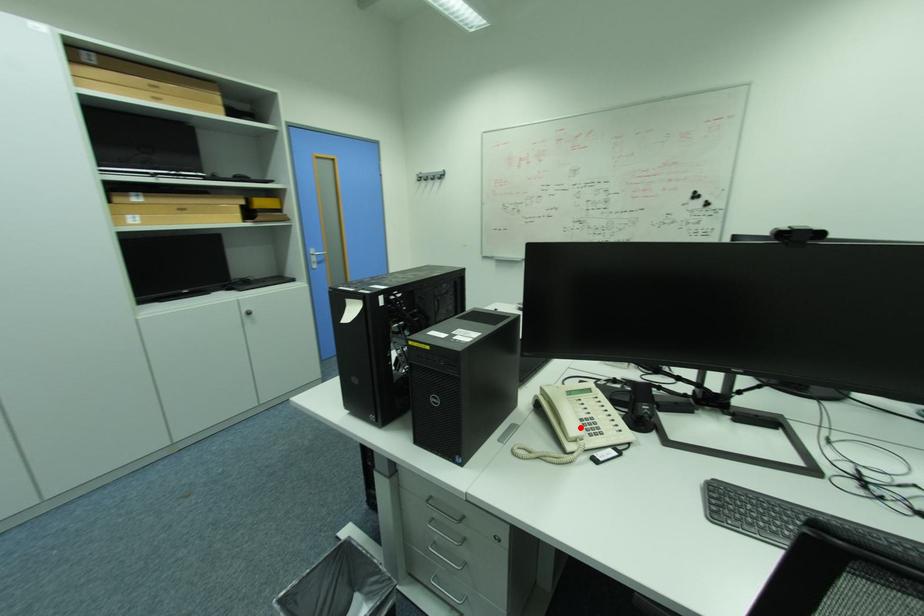
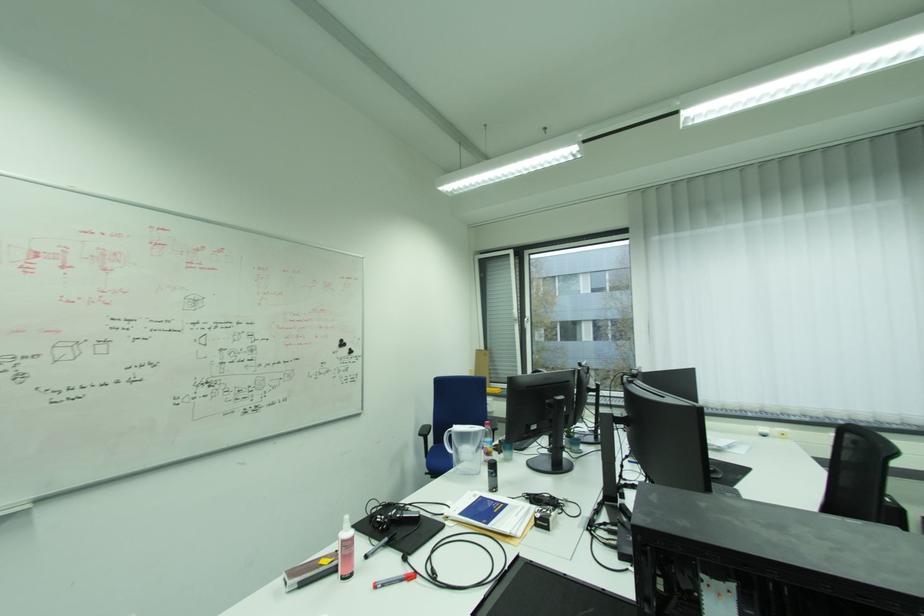
Question: I am providing you with two images of the same scene from different viewpoints. A red point is marked on the first image. Is the red point's position out of view in image 2?

Choices:
 (A) Yes
 (B) No

Answer: (A)